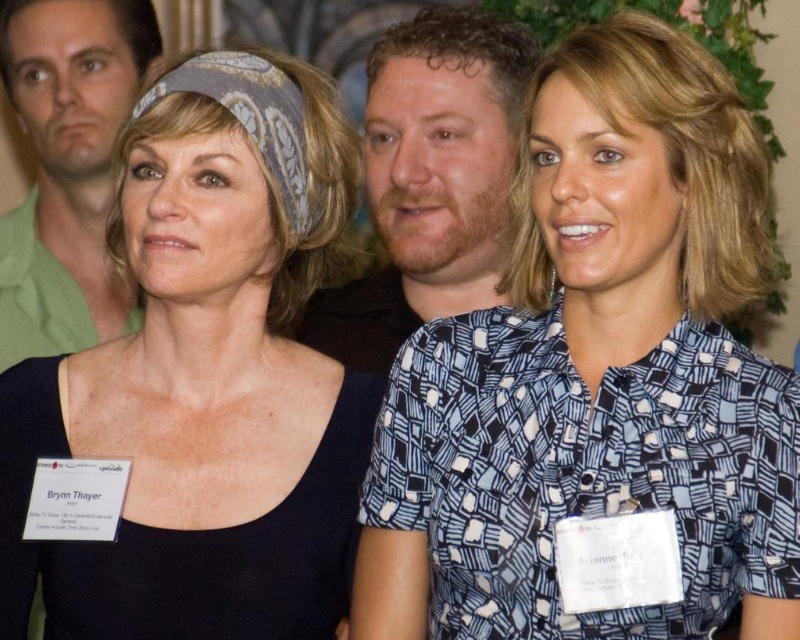
Question: Does black matte dress at center come in front of bearded man at center?

Choices:
 (A) yes
 (B) no

Answer: (A)

Question: Among these points, which one is nearest to the camera?

Choices:
 (A) (513, 561)
 (B) (117, 28)

Answer: (A)

Question: Is bearded man at center bigger than green matte shirt at upper left?

Choices:
 (A) yes
 (B) no

Answer: (B)

Question: Which point appears farthest from the camera in this image?

Choices:
 (A) (532, 51)
 (B) (329, 428)
 (C) (32, 296)
 (D) (654, 157)

Answer: (C)

Question: Does blue printed blouse at center appear over bearded man at center?

Choices:
 (A) no
 (B) yes

Answer: (A)

Question: Among these objects, which one is farthest from the camera?

Choices:
 (A) bearded man at center
 (B) blue printed blouse at center

Answer: (A)